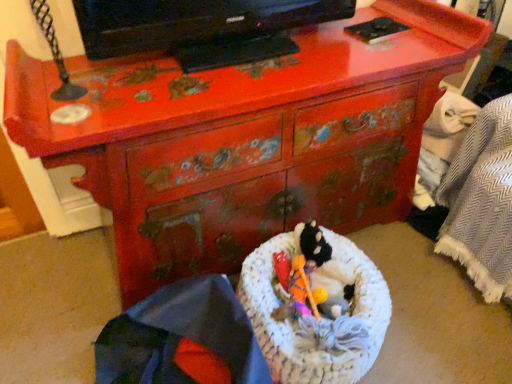
Locate an element on the screen. This screenshot has height=384, width=512. vacant space positioned to the left of woven fabric basket at lower center is located at coordinates (56, 321).